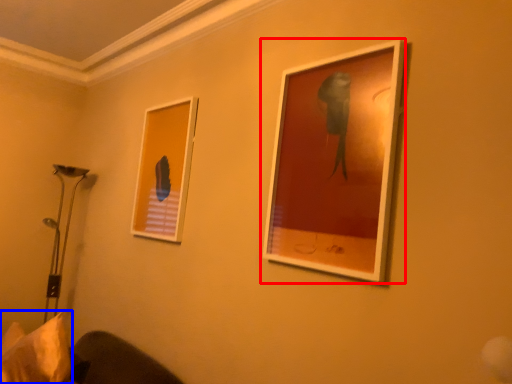
Question: Which of the following is the closest to the observer, picture frame (highlighted by a red box) or pillow (highlighted by a blue box)?

Choices:
 (A) picture frame
 (B) pillow

Answer: (A)